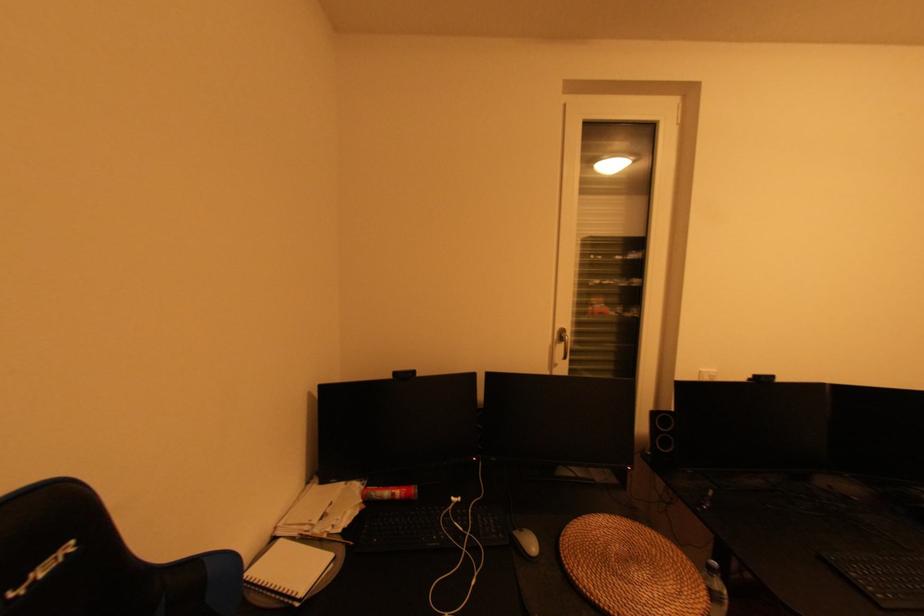
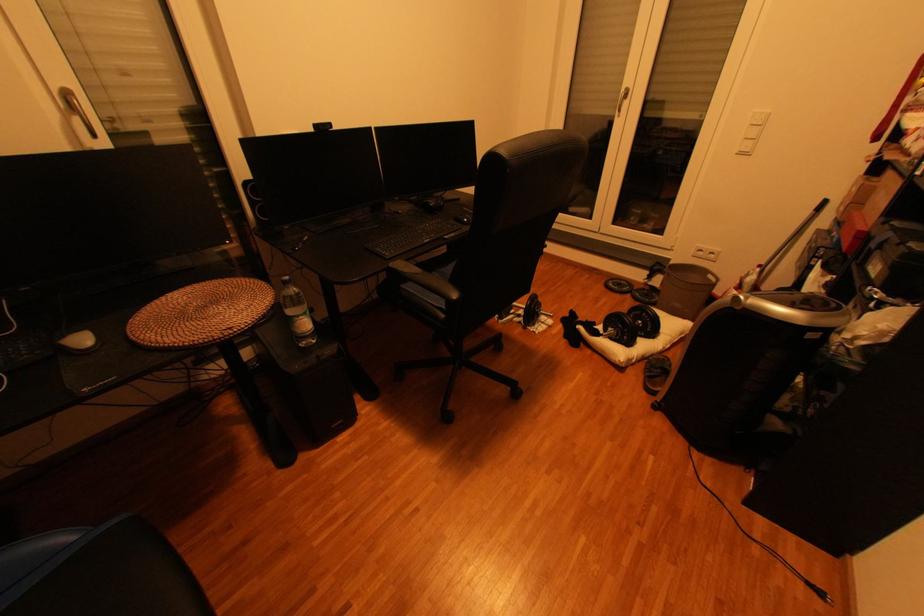
In the second image, find the point that corresponds to point 541,546 in the first image.

(92, 341)